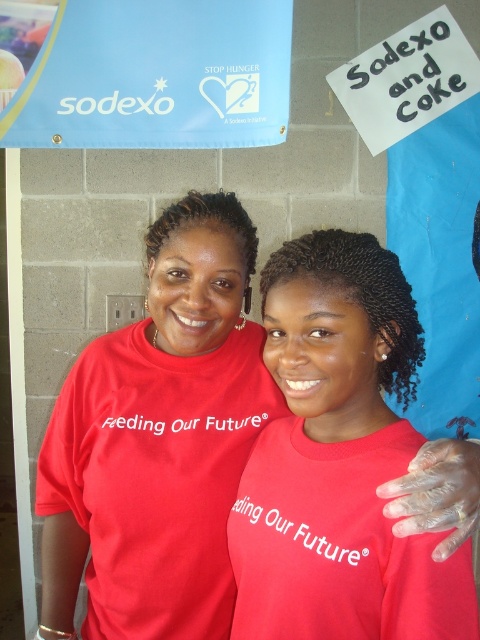
You are a photographer trying to capture a clear photo of the blue fabric sign at upper center. However, the matte red shirt at center is blocking part of the sign. Based on their sizes, which object is more likely to be in the foreground?

The matte red shirt at center has a larger size compared to the blue fabric sign at upper center, so the matte red shirt at center is more likely to be in the foreground.

You are a photographer trying to capture a clear shot of both the matte red shirt at center and the blue fabric sign at upper center. Given their sizes and positions, which object will appear larger in your photo?

The matte red shirt at center will appear larger in the photo because it has a greater height compared to the blue fabric sign at upper center.

Consider the image. You are a photographer standing at a certain distance from the matte red shirt at center. If you want to take a closeup shot of the shirt, would you need to move closer or farther away?

The matte red shirt at center is 34.76 inches away from the viewer. To take a closeup shot, you would need to move closer to the shirt.